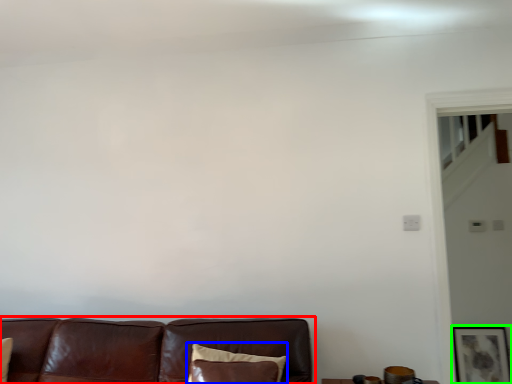
Question: Considering the real-world distances, which object is farthest from studio couch (highlighted by a red box)? pillow (highlighted by a blue box) or picture frame (highlighted by a green box)?

Choices:
 (A) pillow
 (B) picture frame

Answer: (B)